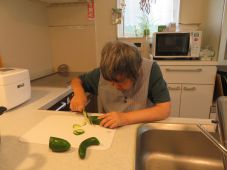
Identify the location of faucet. (222, 118).